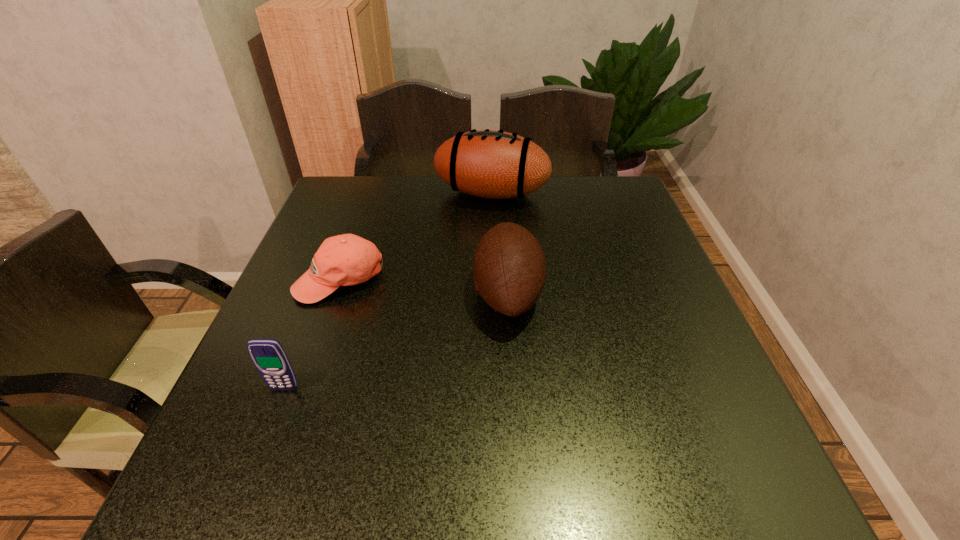
Where is `free region at the far left corner`? The image size is (960, 540). free region at the far left corner is located at coordinates (363, 195).

Find the location of `vacant space at the near left corner`. vacant space at the near left corner is located at coordinates (240, 468).

This screenshot has width=960, height=540. In the image, there is a desktop. In order to click on vacant space at the far right corner in this screenshot , I will do `click(606, 190)`.

Identify the location of vacant region between the tallest object and the shortest object. This screenshot has height=540, width=960. (416, 236).

The height and width of the screenshot is (540, 960). Find the location of `free area in between the cellular telephone and the third shortest object`. free area in between the cellular telephone and the third shortest object is located at coordinates click(396, 341).

Where is `free area in between the cellular telephone and the baseball cap`? This screenshot has width=960, height=540. free area in between the cellular telephone and the baseball cap is located at coordinates [x=312, y=334].

This screenshot has width=960, height=540. I want to click on vacant point located between the nearest object and the farther football, so pos(388,291).

I want to click on free space between the third tallest object and the baseball cap, so click(x=312, y=334).

At what (x,y) coordinates should I click in order to perform the action: click on empty space that is in between the farther football and the third tallest object. Please return your answer as a coordinate pair (x, y). Looking at the image, I should click on (388, 291).

Where is `free area in between the baseball cap and the taller football`? free area in between the baseball cap and the taller football is located at coordinates (416, 236).